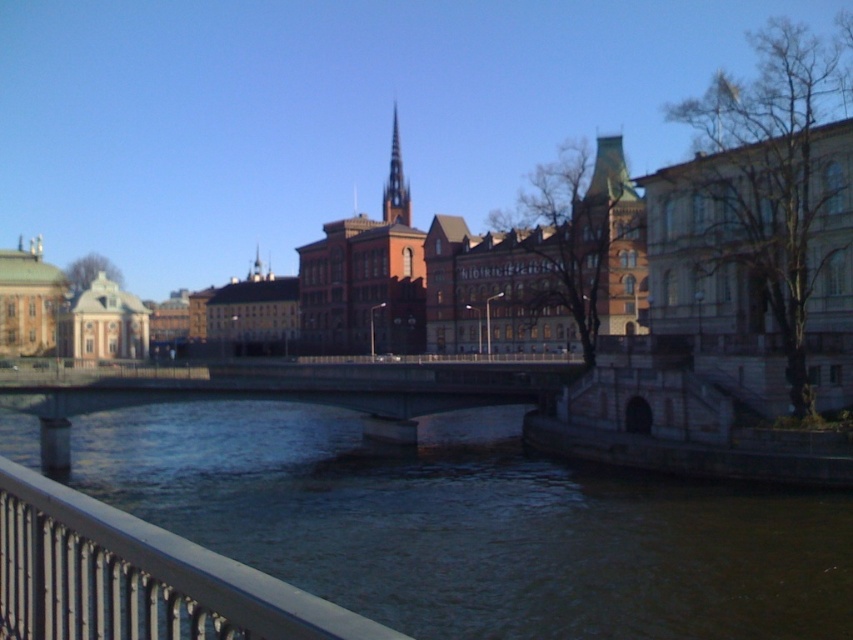
Question: Is brown concrete river at center smaller than smooth stone spire at center?

Choices:
 (A) yes
 (B) no

Answer: (A)

Question: Is the position of brown concrete river at center less distant than that of smooth stone spire at center?

Choices:
 (A) no
 (B) yes

Answer: (B)

Question: Which is nearer to the metallic gray railing at lower left?

Choices:
 (A) brown concrete river at center
 (B) smooth stone spire at center

Answer: (A)

Question: Which object appears farthest from the camera in this image?

Choices:
 (A) smooth stone spire at center
 (B) brown concrete river at center
 (C) metallic gray railing at lower left

Answer: (A)

Question: Which of the following is the closest to the observer?

Choices:
 (A) brown concrete river at center
 (B) metallic gray railing at lower left

Answer: (B)

Question: Can you confirm if brown concrete river at center is wider than smooth stone spire at center?

Choices:
 (A) no
 (B) yes

Answer: (B)